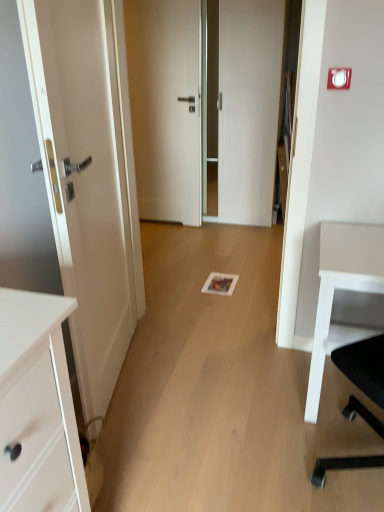
The image size is (384, 512). Identify the location of vacant area in front of white matte door at center, the third door when ordered from front to back. (172, 234).